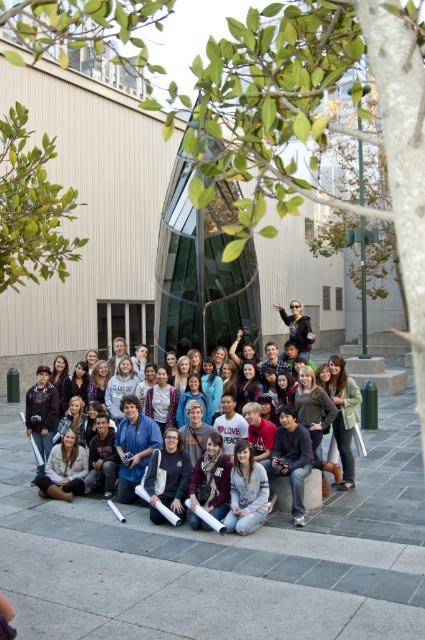
You are standing in front of the modern building and see the matte black jacket at center. If you want to reach the jacket quickly, how many steps would you estimate you need to take?

The matte black jacket at center is 6.99 meters away from viewer. Assuming an average step length of about 0.75 meters, you would need approximately 9 steps to reach it.

You are standing at the entrance of the modern building and want to find the matte black jacket at center. According to the coordinates provided, in which direction should you look to locate it?

The matte black jacket at center is located at coordinates point [325,413], so you should look towards the lower right direction from the entrance to locate it.